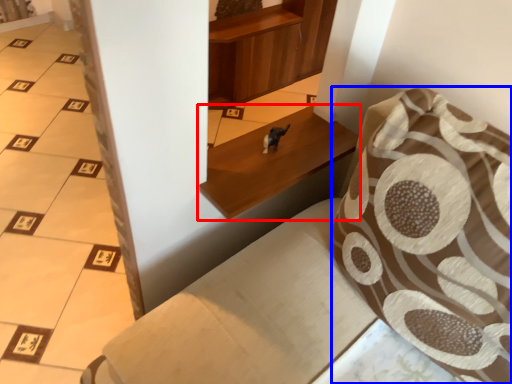
Question: Among these objects, which one is nearest to the camera, furniture (highlighted by a red box) or throw pillow (highlighted by a blue box)?

Choices:
 (A) furniture
 (B) throw pillow

Answer: (B)